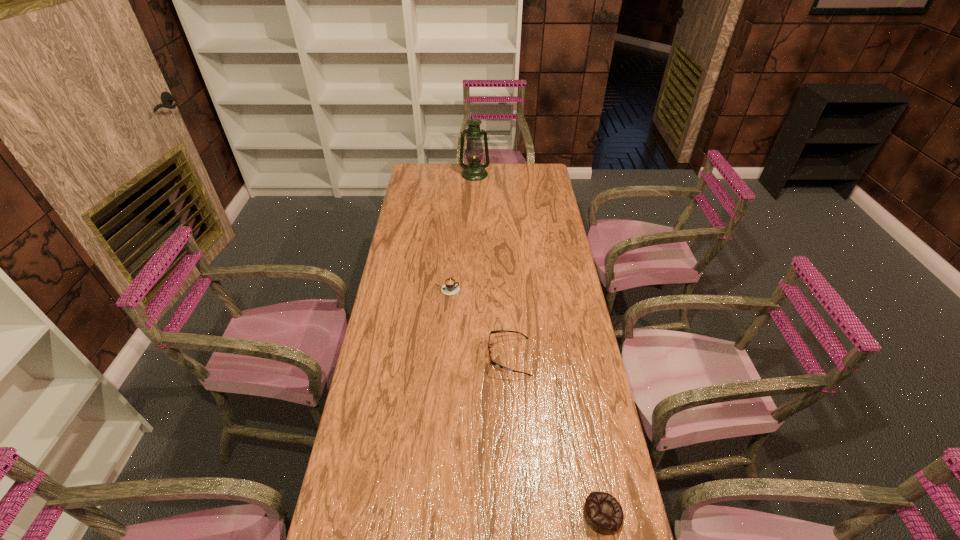
You are a GUI agent. You are given a task and a screenshot of the screen. Output one action in this format:
    pyautogui.click(x=<x>, y=<y>)
    Task: Click on the vacant point that satisfies the following two spatial constraints: 1. on the front side of the rightmost object; 2. on the left side of the farthest object
    The image size is (960, 540).
    Given the screenshot: What is the action you would take?
    pyautogui.click(x=468, y=514)

Locate an element on the screen. Image resolution: width=960 pixels, height=540 pixels. free point that satisfies the following two spatial constraints: 1. on the front-facing side of the third farthest object; 2. on the left side of the beanbag is located at coordinates (518, 514).

Find the location of `free space in the image that satisfies the following two spatial constraints: 1. with the handle on the side of the rightmost object; 2. on the right side of the cappuccino`. free space in the image that satisfies the following two spatial constraints: 1. with the handle on the side of the rightmost object; 2. on the right side of the cappuccino is located at coordinates (429, 514).

The image size is (960, 540). Identify the location of free spot that satisfies the following two spatial constraints: 1. on the front-facing side of the beanbag; 2. on the left side of the sunglasses. (518, 514).